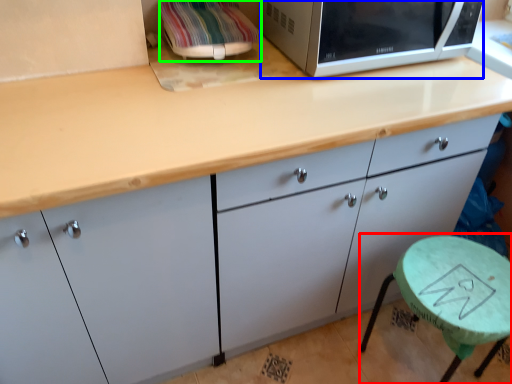
Question: Based on their relative distances, which object is farther from round table (highlighted by a red box)? Choose from microwave oven (highlighted by a blue box) and appliance (highlighted by a green box).

Choices:
 (A) microwave oven
 (B) appliance

Answer: (B)